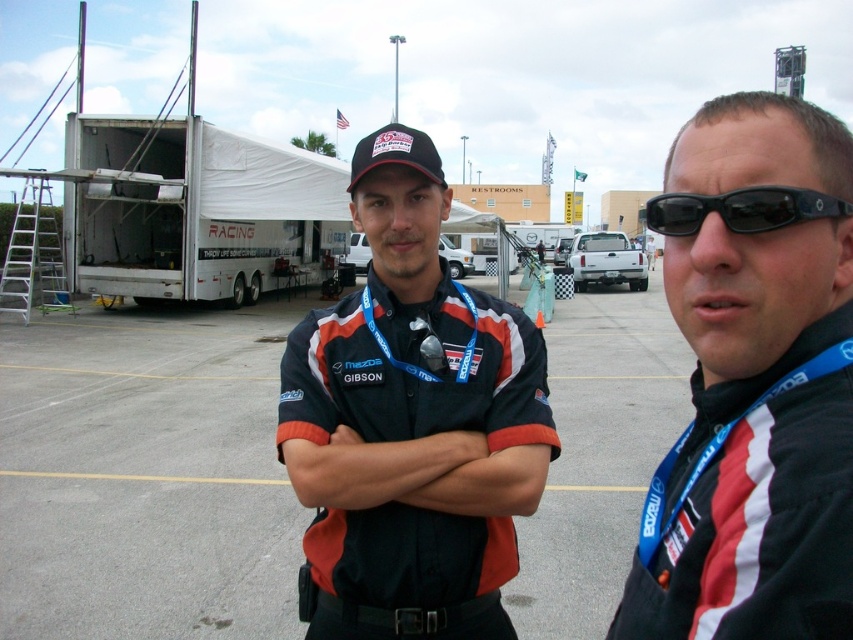
Who is taller, white matte trailer truck at left or black plastic sunglasses at right?

With more height is white matte trailer truck at left.

Is white matte trailer truck at left further to camera compared to black plastic sunglasses at right?

That is True.

Which is behind, point (71, 134) or point (738, 232)?

The point (71, 134) is more distant.

Where is `white matte trailer truck at left`? This screenshot has height=640, width=853. white matte trailer truck at left is located at coordinates (195, 211).

Between point (735, 385) and point (91, 243), which one is positioned in front?

Point (735, 385) is more forward.

Does black fabric shirt at center appear over white matte trailer truck at left?

Actually, black fabric shirt at center is below white matte trailer truck at left.

Is point (813, 460) closer to viewer compared to point (132, 186)?

Yes.

Locate an element on the screen. This screenshot has height=640, width=853. black fabric shirt at center is located at coordinates 753,381.

Is matte black shirt at center to the right of white matte trailer truck at left from the viewer's perspective?

Correct, you'll find matte black shirt at center to the right of white matte trailer truck at left.

Can you confirm if matte black shirt at center is thinner than white matte trailer truck at left?

Correct, matte black shirt at center's width is less than white matte trailer truck at left's.

Is point (410, 339) farther from camera compared to point (204, 156)?

No, (410, 339) is in front of (204, 156).

The height and width of the screenshot is (640, 853). I want to click on matte black shirt at center, so click(x=412, y=422).